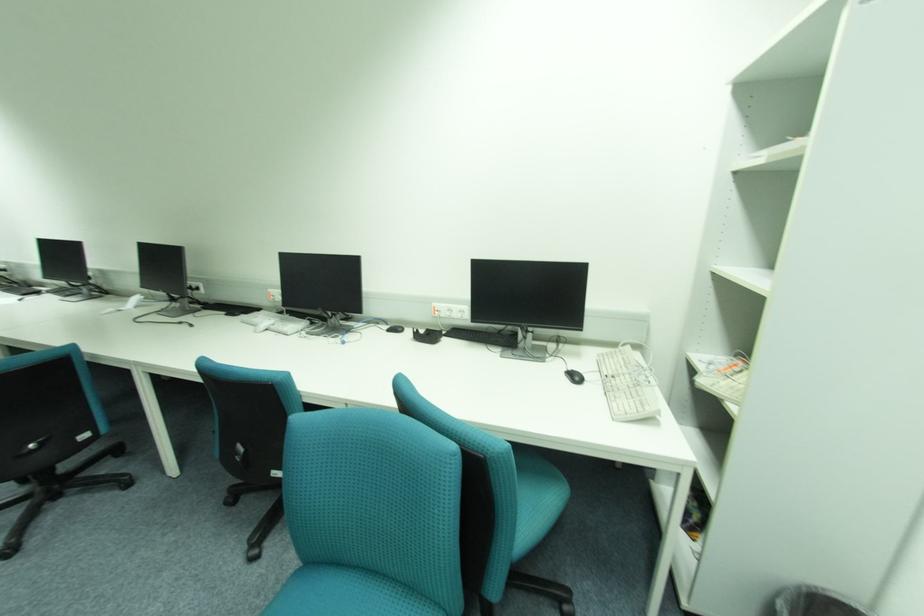
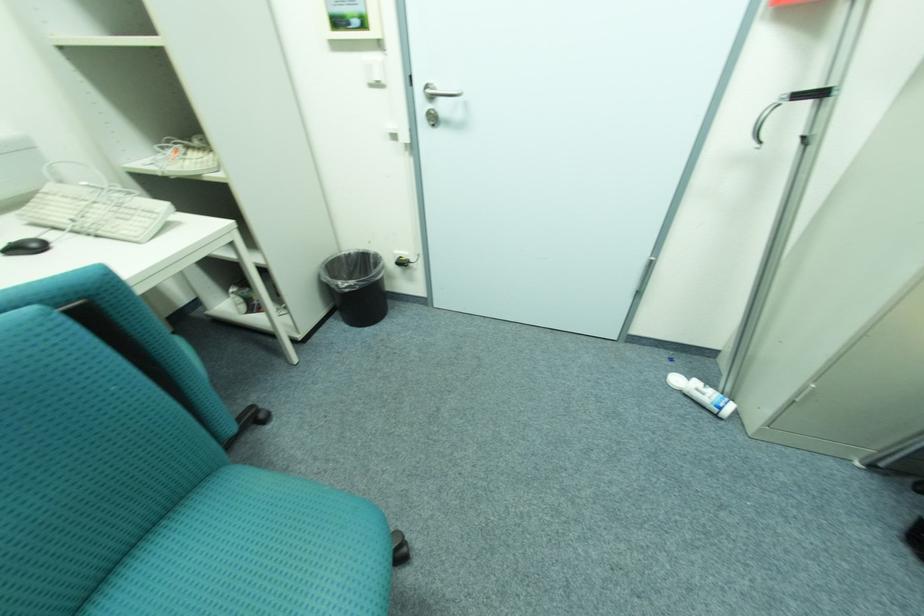
In the second image, find the point that corresponds to (x=584, y=379) in the first image.

(43, 246)